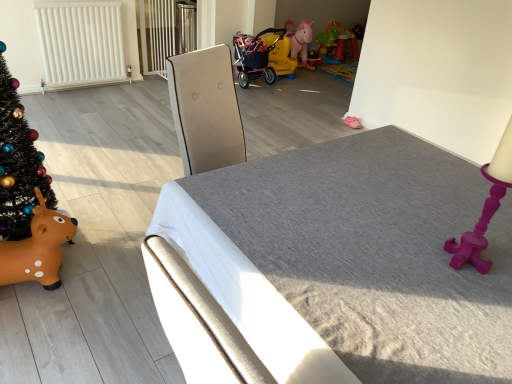
Question: Would you say yellow plastic stroller at center, the third toy when ordered from right to left, is inside or outside black matte christmas tree at left?

Choices:
 (A) outside
 (B) inside

Answer: (A)

Question: In terms of width, does yellow plastic stroller at center, which ranks as the 2th toy in front-to-back order, look wider or thinner when compared to black matte christmas tree at left?

Choices:
 (A) thin
 (B) wide

Answer: (B)

Question: Which object is positioned farthest from the white matte radiator at upper left?

Choices:
 (A) brown rubber reindeer at lower left, which is counted as the fourth toy, starting from the right
 (B) yellow plastic stroller at center, the third toy positioned from the top
 (C) yellow plastic stroller at center, placed as the 3th toy when sorted from bottom to top
 (D) textured gray mattress at center
 (E) black matte christmas tree at left

Answer: (D)

Question: Which is nearer to the yellow plastic stroller at center, the 2th toy from the top?

Choices:
 (A) brown rubber reindeer at lower left, placed as the 1th toy when sorted from bottom to top
 (B) black matte christmas tree at left
 (C) rubberized plastic playset at upper center, which is the first toy from top to bottom
 (D) white matte radiator at upper left
 (E) textured gray mattress at center

Answer: (C)